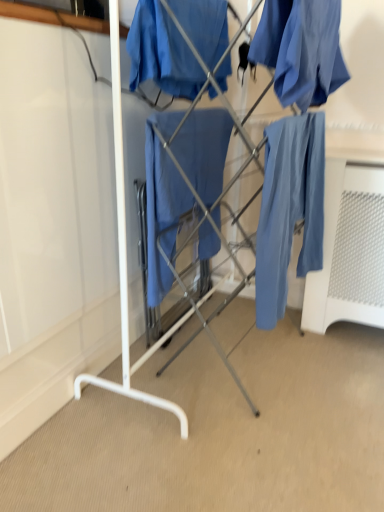
Where is `vacant region to the left of matte blue fabric at center`? This screenshot has height=512, width=384. vacant region to the left of matte blue fabric at center is located at coordinates (140, 370).